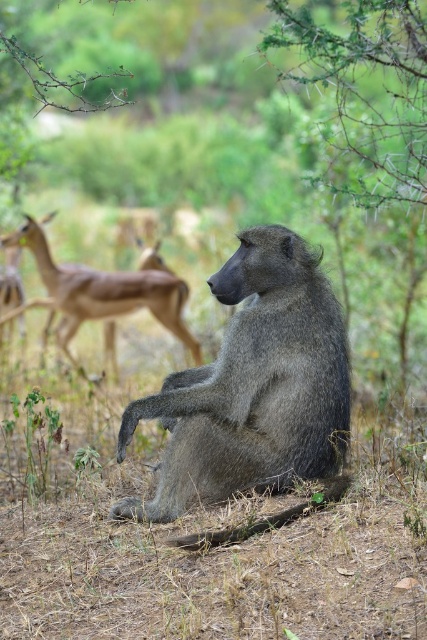
Does gray furry baboon at center have a greater height compared to green spiny branch at upper right?

No.

Does point (332, 310) come closer to viewer compared to point (350, 92)?

Yes, it is in front of point (350, 92).

Describe the element at coordinates (254, 385) in the screenshot. I see `gray furry baboon at center` at that location.

You are a GUI agent. You are given a task and a screenshot of the screen. Output one action in this format:
    pyautogui.click(x=<x>, y=<y>)
    Task: Click on the gray furry baboon at center
    The width and height of the screenshot is (427, 640).
    Given the screenshot: What is the action you would take?
    pyautogui.click(x=254, y=385)

Looking at this image, which is more to the right, gray furry baboon at center or brown glossy antelope at left?

From the viewer's perspective, gray furry baboon at center appears more on the right side.

Is gray furry baboon at center below brown glossy antelope at left?

Indeed, gray furry baboon at center is positioned under brown glossy antelope at left.

Which is in front, point (306, 477) or point (108, 353)?

Point (306, 477)

The image size is (427, 640). I want to click on gray furry baboon at center, so click(254, 385).

What do you see at coordinates (359, 86) in the screenshot? I see `green spiny branch at upper right` at bounding box center [359, 86].

Is green spiny branch at upper right to the left of brown glossy antelope at left from the viewer's perspective?

Incorrect, green spiny branch at upper right is not on the left side of brown glossy antelope at left.

Which is behind, point (339, 35) or point (173, 285)?

Point (339, 35)

What are the coordinates of `green spiny branch at upper right` in the screenshot? It's located at (359, 86).